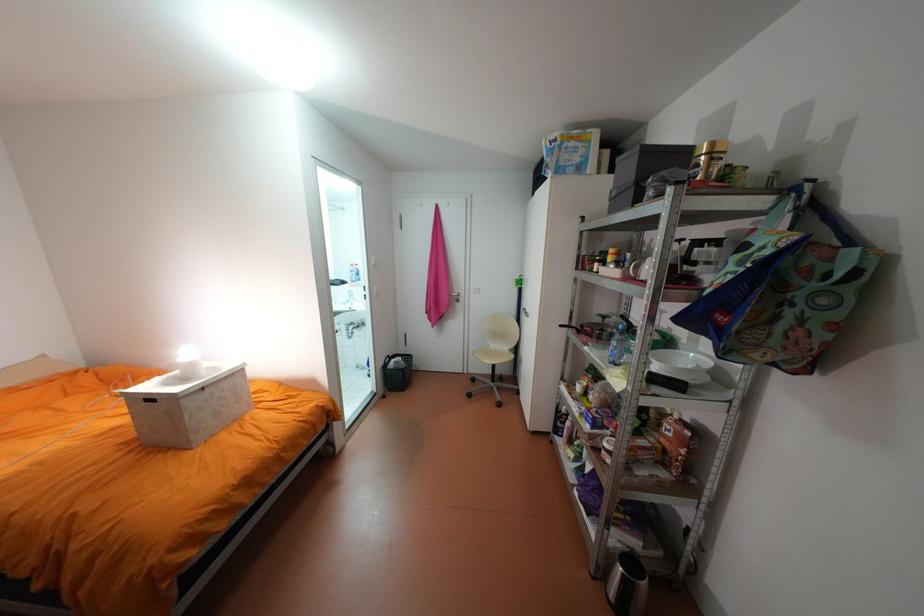
Which object does [617,345] point to?

It corresponds to the clear water bottle in the image.